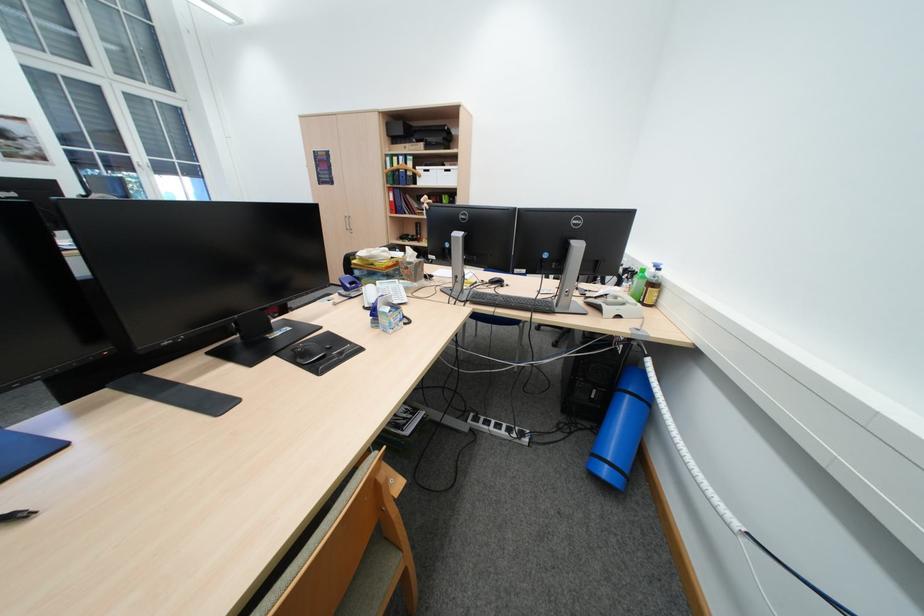
What do you see at coordinates (622, 428) in the screenshot? I see `the blue rolled mat` at bounding box center [622, 428].